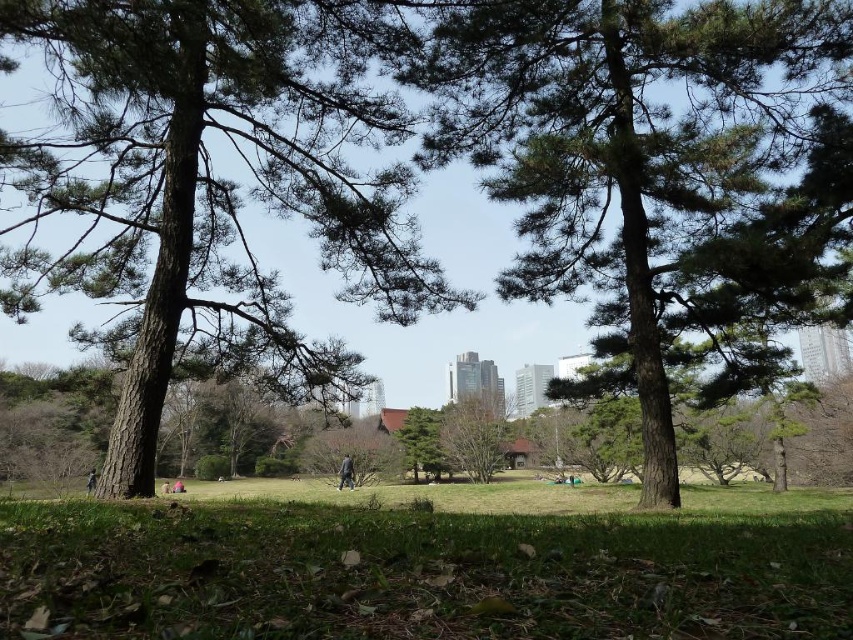
You are a GUI agent. You are given a task and a screenshot of the screen. Output one action in this format:
    pyautogui.click(x=<x>, y=<y>)
    Task: Click on the green grass at center
    The image size is (853, 640).
    Given the screenshot: What is the action you would take?
    pyautogui.click(x=428, y=563)

From the picture: Does green grass at center have a lesser width compared to green textured tree at center?

Incorrect, green grass at center's width is not less than green textured tree at center's.

This screenshot has height=640, width=853. Describe the element at coordinates (428, 563) in the screenshot. I see `green grass at center` at that location.

Find the location of a particular element. The height and width of the screenshot is (640, 853). green grass at center is located at coordinates (428, 563).

Which is behind, point (419, 444) or point (183, 484)?

The point (419, 444) is behind.

Who is more forward, (428, 419) or (173, 483)?

Point (173, 483) is in front.

Where is `green textured tree at center`? The width and height of the screenshot is (853, 640). green textured tree at center is located at coordinates (422, 442).

Is dark gray fabric jacket at center below dark gray fabric person at lower left?

Indeed, dark gray fabric jacket at center is positioned under dark gray fabric person at lower left.

Who is positioned more to the left, dark gray fabric jacket at center or dark gray fabric person at lower left?

Positioned to the left is dark gray fabric person at lower left.

Image resolution: width=853 pixels, height=640 pixels. Describe the element at coordinates (346, 472) in the screenshot. I see `dark gray fabric jacket at center` at that location.

The width and height of the screenshot is (853, 640). What are the coordinates of `dark gray fabric jacket at center` in the screenshot? It's located at (346, 472).